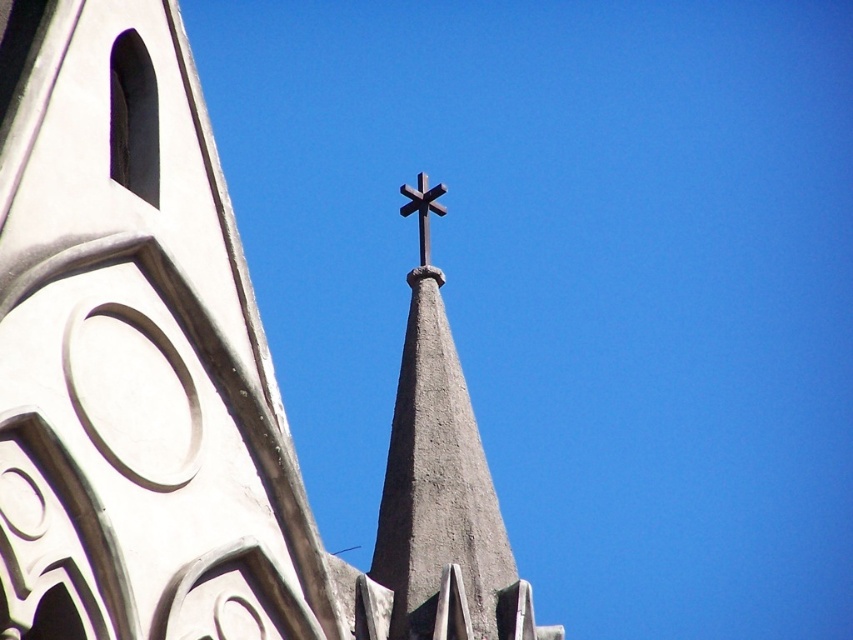
Can you confirm if smooth gray steeple at center is wider than dark brown wooden cross at center?

Indeed, smooth gray steeple at center has a greater width compared to dark brown wooden cross at center.

Who is positioned more to the right, smooth gray steeple at center or dark brown wooden cross at center?

Positioned to the right is dark brown wooden cross at center.

The width and height of the screenshot is (853, 640). In order to click on smooth gray steeple at center in this screenshot , I will do `click(190, 381)`.

Where is `smooth gray steeple at center`? This screenshot has height=640, width=853. smooth gray steeple at center is located at coordinates (190, 381).

How distant is gray stone spire at center from dark brown wooden cross at center?

The distance of gray stone spire at center from dark brown wooden cross at center is 18.42 meters.

Is gray stone spire at center taller than dark brown wooden cross at center?

Yes, gray stone spire at center is taller than dark brown wooden cross at center.

Find the location of a particular element. gray stone spire at center is located at coordinates (439, 481).

Is smooth gray steeple at center to the right of gray stone spire at center from the viewer's perspective?

No, smooth gray steeple at center is not to the right of gray stone spire at center.

This screenshot has width=853, height=640. Identify the location of smooth gray steeple at center. (190, 381).

Identify the location of smooth gray steeple at center. Image resolution: width=853 pixels, height=640 pixels. (190, 381).